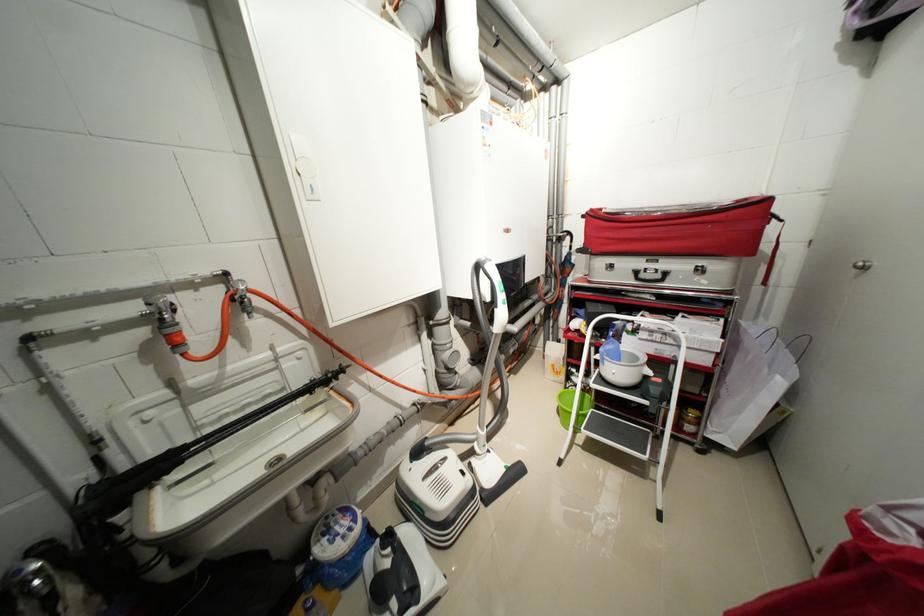
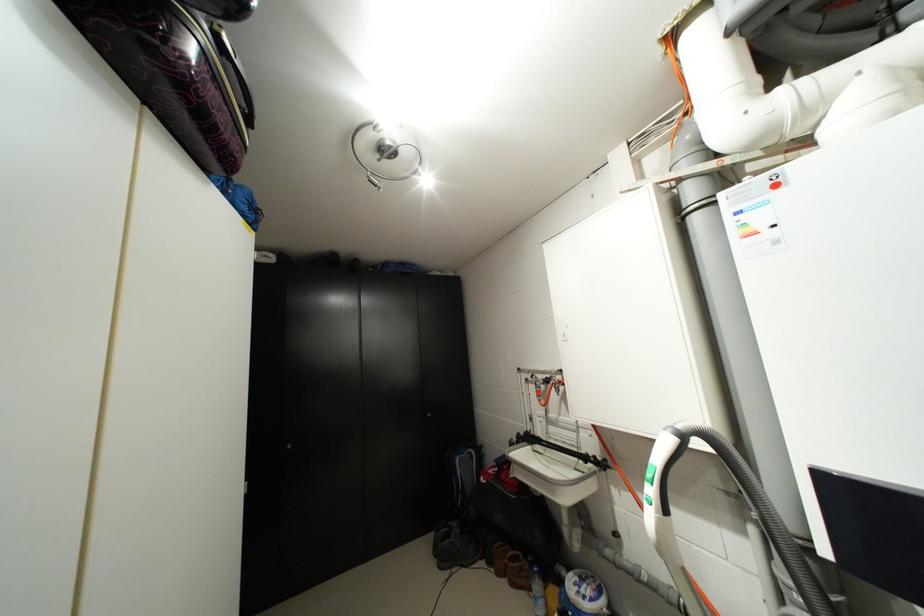
The point at (361, 521) is marked in the first image. Where is the corresponding point in the second image?

(599, 600)